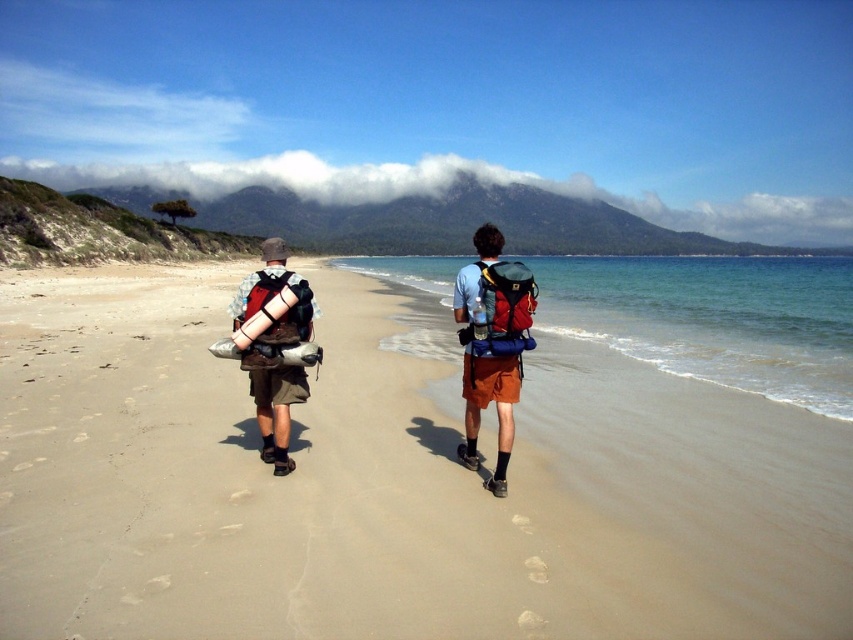
You are planning to cross the clear water at right to reach the other side. The camouflage fabric backpack at center is 30 cm wide. What is the minimum width you need to ensure your crossing is safe?

The clear water at right might be wider than the camouflage fabric backpack at center, which is 30 cm wide. To ensure safe crossing, you should measure the width of the clear water at right and confirm it is at least 30 cm wider than the backpack.